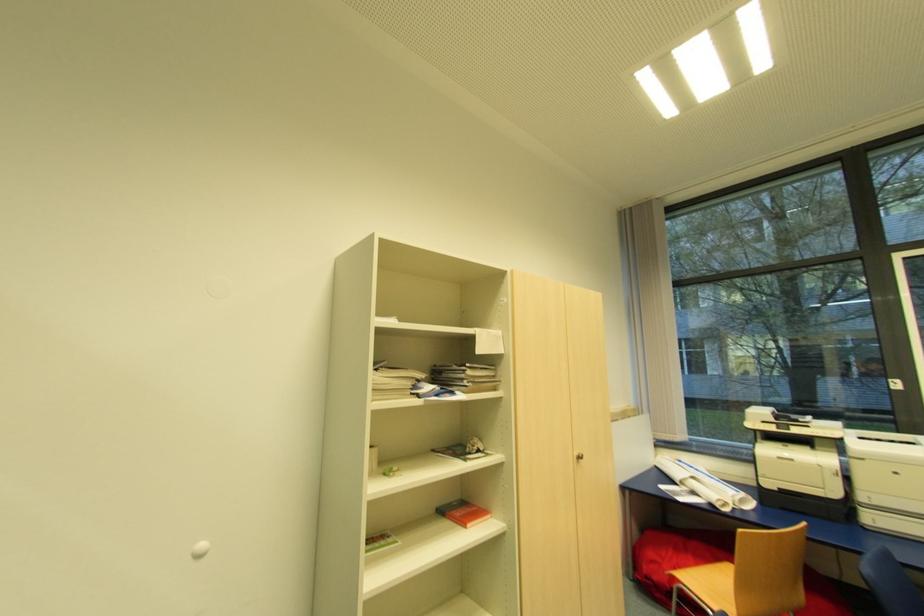
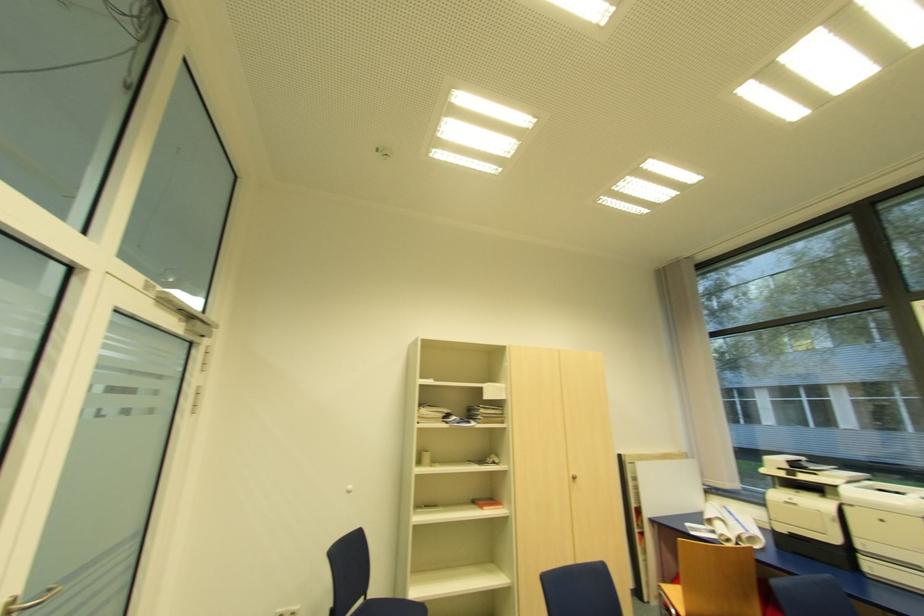
In a continuous first-person perspective shot, in which direction is the camera moving?

The cameraman walked toward right, backward.